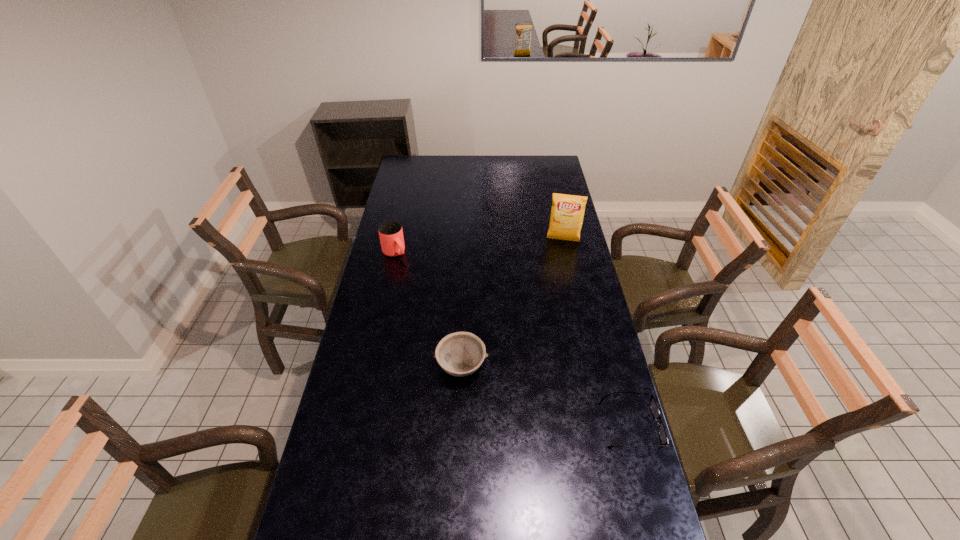
Identify the location of free spot at the right edge of the desktop. (570, 351).

Where is `vacant point located between the tallest object and the second nearest object`? vacant point located between the tallest object and the second nearest object is located at coordinates (512, 303).

This screenshot has width=960, height=540. In order to click on free area in between the crisp (potato chip) and the cup in this screenshot , I will do `click(479, 246)`.

At what (x,y) coordinates should I click in order to perform the action: click on unoccupied area between the crisp (potato chip) and the nearest object. Please return your answer as a coordinate pair (x, y). The height and width of the screenshot is (540, 960). Looking at the image, I should click on (597, 333).

Identify the location of free area in between the second object from left to right and the crisp (potato chip). (512, 303).

At what (x,y) coordinates should I click in order to perform the action: click on free spot between the nearest object and the tallest object. Please return your answer as a coordinate pair (x, y). The width and height of the screenshot is (960, 540). Looking at the image, I should click on (597, 333).

Find the location of a particular element. This screenshot has width=960, height=540. vacant area that lies between the shortest object and the third shortest object is located at coordinates (513, 339).

Where is `unoccupied area between the leftmost object and the nearest object`? The image size is (960, 540). unoccupied area between the leftmost object and the nearest object is located at coordinates pyautogui.click(x=513, y=339).

The image size is (960, 540). Find the location of `vacant area that lies between the shortest object and the crisp (potato chip)`. vacant area that lies between the shortest object and the crisp (potato chip) is located at coordinates (597, 333).

The image size is (960, 540). I want to click on free spot between the nearest object and the third object from right to left, so click(546, 396).